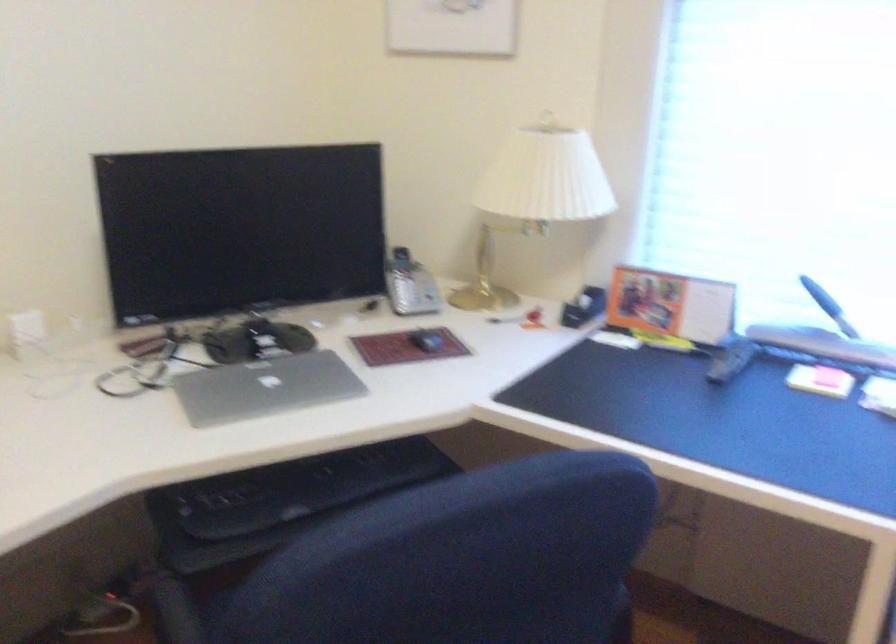
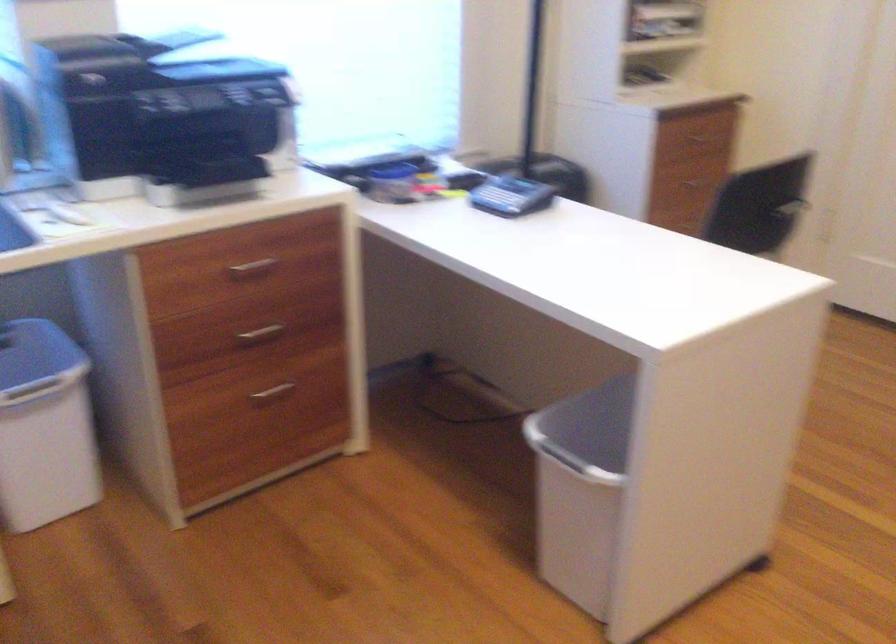
First-person continuous shooting, in which direction is the camera rotating?

The rotation direction of the camera is right-down.